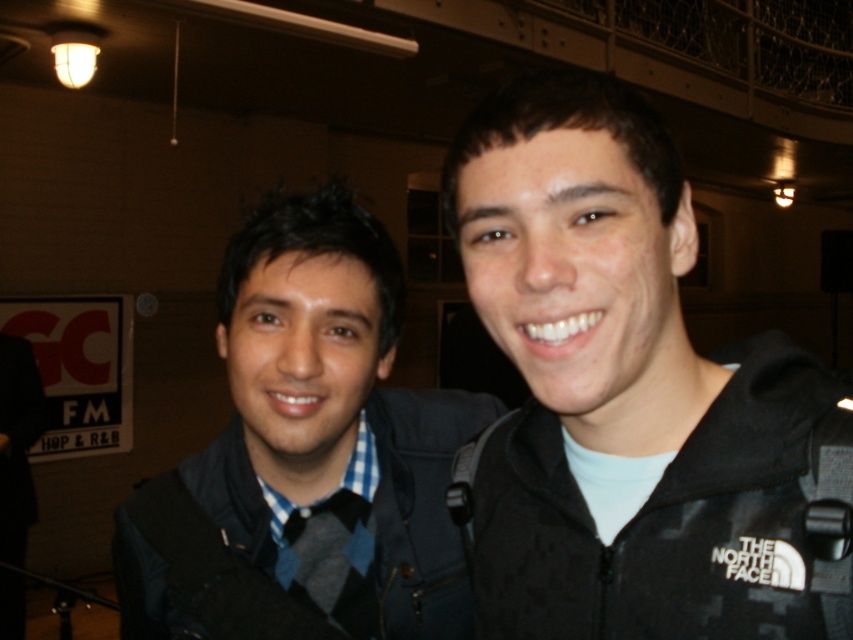
Question: Among these points, which one is farthest from the camera?

Choices:
 (A) (200, 589)
 (B) (811, 541)

Answer: (A)

Question: Is blue checkered shirt at center further to the viewer compared to black fabric jacket at right?

Choices:
 (A) no
 (B) yes

Answer: (B)

Question: Among these points, which one is nearest to the camera?

Choices:
 (A) (305, 609)
 (B) (769, 465)

Answer: (B)

Question: Is blue checkered shirt at center to the left of black fabric jacket at right from the viewer's perspective?

Choices:
 (A) yes
 (B) no

Answer: (A)

Question: Which object is closer to the camera taking this photo?

Choices:
 (A) blue checkered shirt at center
 (B) black fabric jacket at right

Answer: (B)

Question: Does blue checkered shirt at center appear over black fabric jacket at right?

Choices:
 (A) no
 (B) yes

Answer: (A)